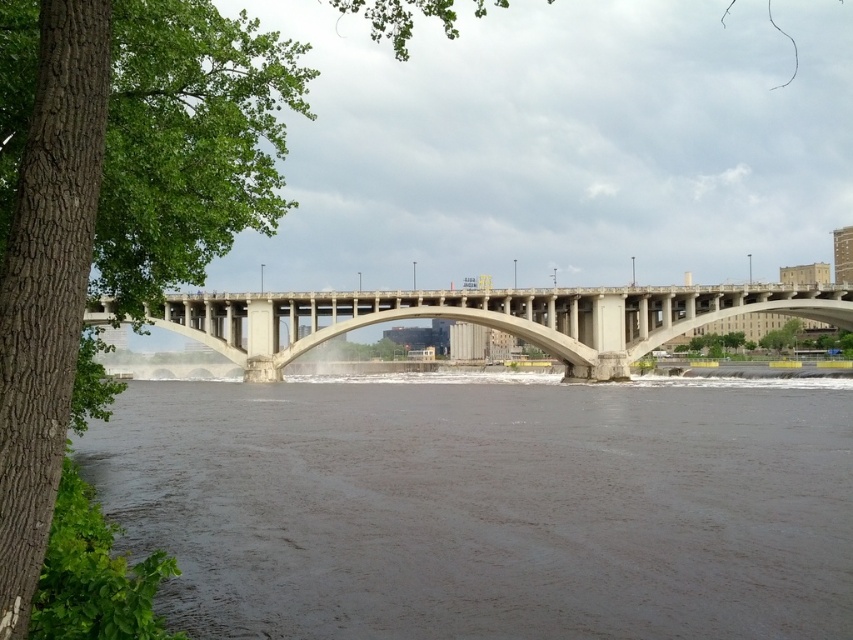
Who is positioned more to the right, green rough bark tree at left or concrete bridge at center?

Positioned to the right is concrete bridge at center.

Who is more forward, (194, 184) or (315, 305)?

Point (194, 184) is more forward.

This screenshot has height=640, width=853. Describe the element at coordinates (114, 204) in the screenshot. I see `green rough bark tree at left` at that location.

Image resolution: width=853 pixels, height=640 pixels. What are the coordinates of `green rough bark tree at left` in the screenshot? It's located at (114, 204).

Is brown muddy water at center closer to the viewer compared to green rough bark tree at left?

No, brown muddy water at center is further to the viewer.

Looking at this image, is brown muddy water at center to the left of green rough bark tree at left from the viewer's perspective?

In fact, brown muddy water at center is to the right of green rough bark tree at left.

Find the location of a particular element. Image resolution: width=853 pixels, height=640 pixels. brown muddy water at center is located at coordinates (488, 506).

Image resolution: width=853 pixels, height=640 pixels. What are the coordinates of `brown muddy water at center` in the screenshot? It's located at (488, 506).

In the scene shown: Does brown muddy water at center appear on the left side of concrete bridge at center?

Indeed, brown muddy water at center is positioned on the left side of concrete bridge at center.

Who is lower down, brown muddy water at center or concrete bridge at center?

brown muddy water at center is lower down.

Who is more forward, (x=392, y=422) or (x=654, y=340)?

Point (x=392, y=422)

Find the location of a particular element. The height and width of the screenshot is (640, 853). brown muddy water at center is located at coordinates (488, 506).